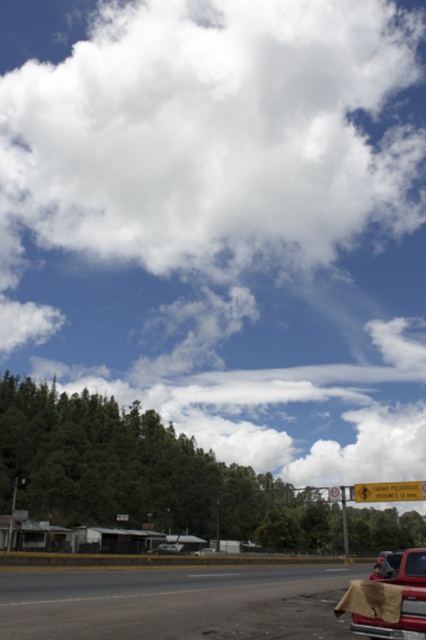
Describe the element at coordinates (212, 134) in the screenshot. The width and height of the screenshot is (426, 640). I see `white fluffy cloud at upper center` at that location.

Who is positioned more to the right, white fluffy cloud at upper center or metallic silver car at center?

From the viewer's perspective, white fluffy cloud at upper center appears more on the right side.

Is point (5, 144) closer to viewer compared to point (170, 548)?

No, it is behind (170, 548).

Find the location of a particular element. white fluffy cloud at upper center is located at coordinates (212, 134).

Can you confirm if red matte truck at lower right is shorter than silver metallic sedan at center?

Indeed, red matte truck at lower right has a lesser height compared to silver metallic sedan at center.

Does red matte truck at lower right appear over silver metallic sedan at center?

Correct, red matte truck at lower right is located above silver metallic sedan at center.

This screenshot has width=426, height=640. I want to click on red matte truck at lower right, so click(402, 600).

Locate an element on the screen. This screenshot has width=426, height=640. red matte truck at lower right is located at coordinates (402, 600).

Who is more distant from viewer, (420, 496) or (344, 509)?

The point (344, 509) is more distant.

Is point (389, 486) farther from camera compared to point (340, 499)?

No, (389, 486) is closer to viewer.

Is point (393, 488) positioned before point (345, 525)?

Yes.

Identify the location of yellow plastic sign at upper center. This screenshot has height=640, width=426. (389, 492).